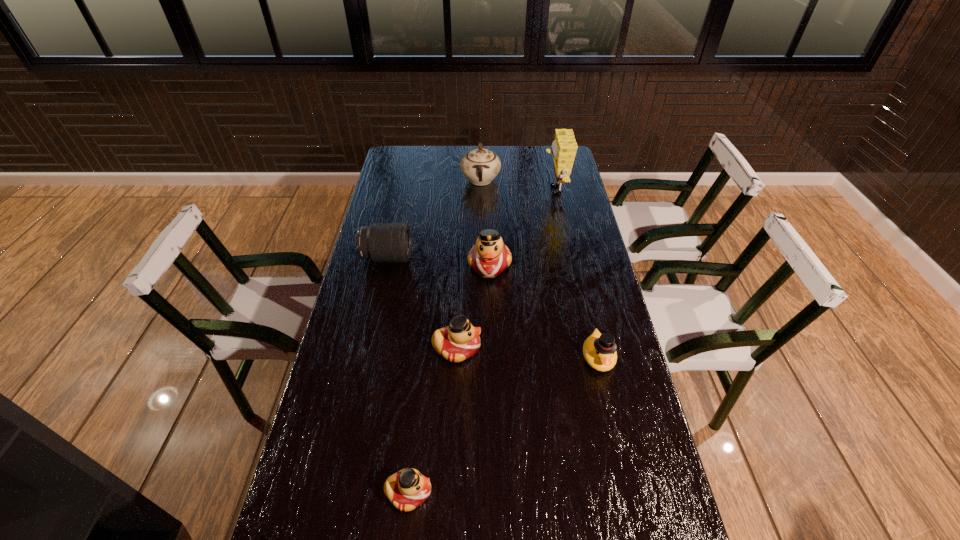
Identify the location of sponge. [x=564, y=146].

Find the location of a particular element. This screenshot has height=540, width=960. yellow sponge is located at coordinates click(x=564, y=146).

You are a GUI agent. You are given a task and a screenshot of the screen. Output one action in this format:
    pyautogui.click(x=<x>, y=<y>)
    Task: Click on the chinaware
    Image resolution: width=960 pixels, height=540 pixels.
    Given the screenshot: What is the action you would take?
    pyautogui.click(x=480, y=166)

Locate an element on the screen. This screenshot has height=540, width=960. the tallest duck is located at coordinates (489, 257).

Identify the location of the farthest duck. The image size is (960, 540). (489, 257).

Image resolution: width=960 pixels, height=540 pixels. I want to click on gray telephoto lens, so click(380, 242).

Identify the location of telephoto lens. (380, 242).

Locate an element on the screen. Image resolution: width=960 pixels, height=540 pixels. the second biggest red duck is located at coordinates (460, 340).

The height and width of the screenshot is (540, 960). In order to click on yellow duck in this screenshot , I will do `click(599, 350)`.

Find the location of `the nearest object`. the nearest object is located at coordinates (407, 489).